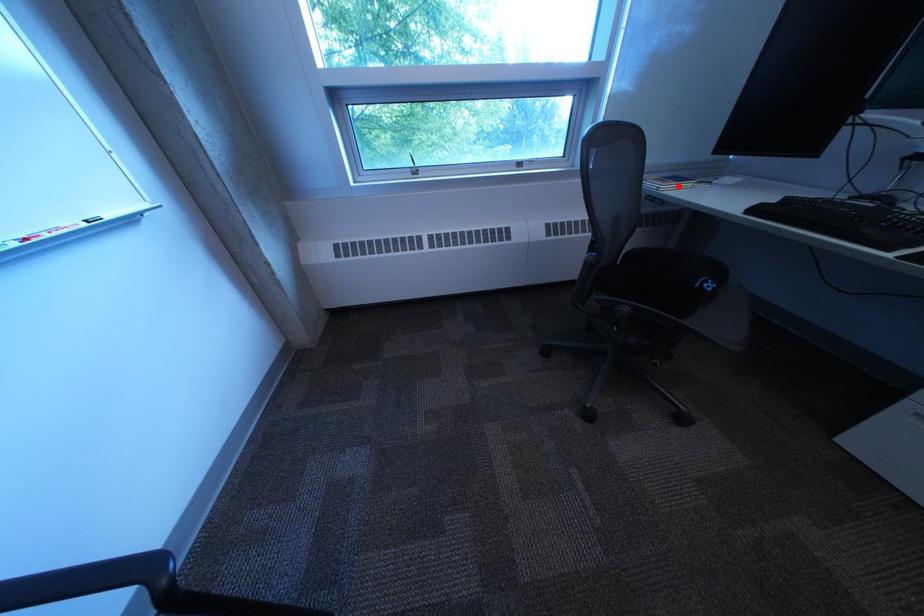
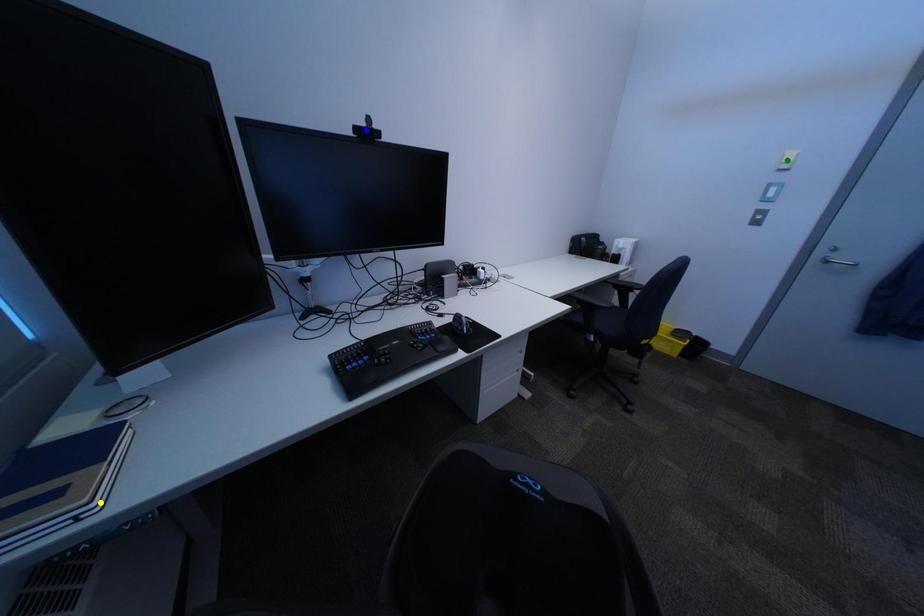
Question: I am providing you with two images of the same scene from different viewpoints. A red point is marked on the first image. You are given multiple points on the second image. Which point in image 2 represents the same 3d spot as the red point in image 1?

Choices:
 (A) yellow point
 (B) blue point
 (C) green point

Answer: (A)